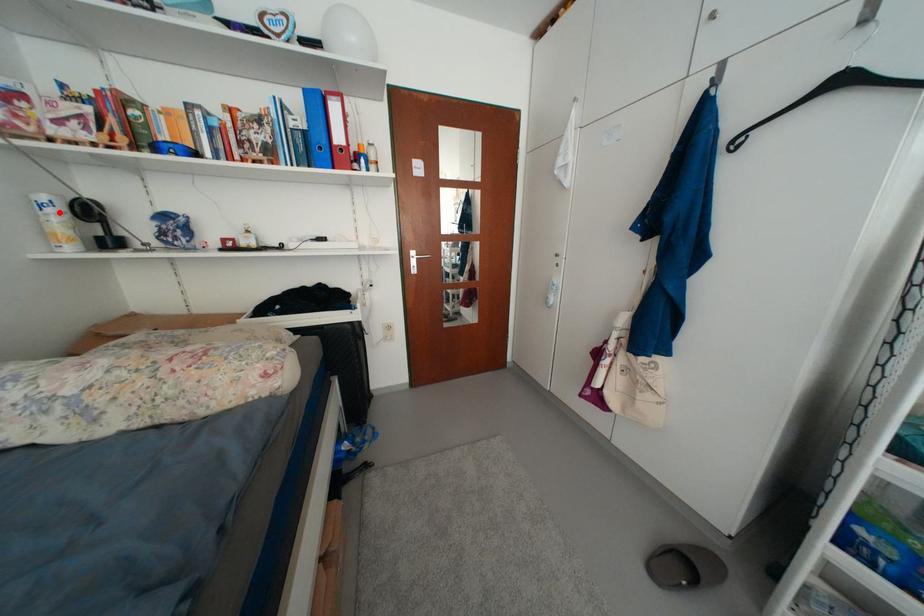
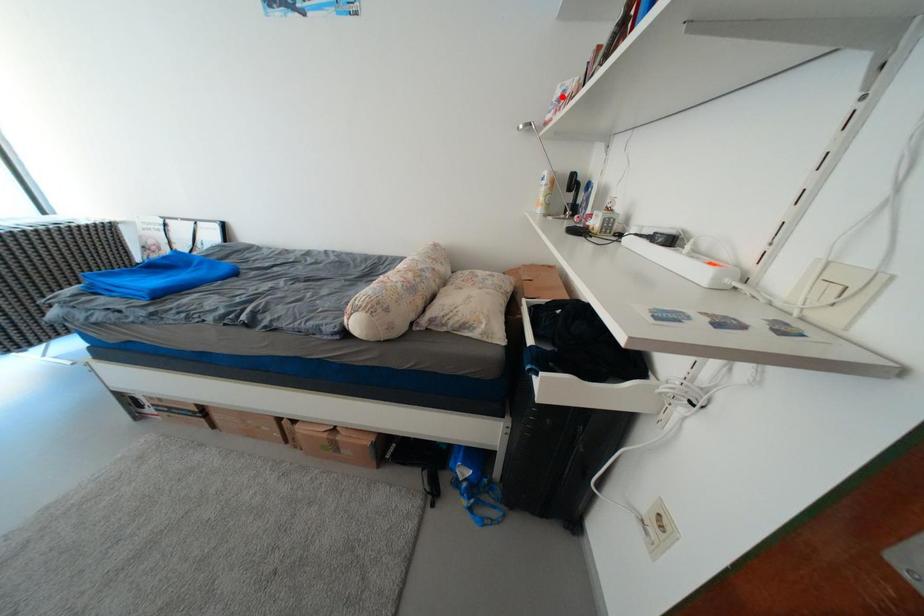
I am providing you with two images of the same scene from different viewpoints. A red point is marked on the first image and another point is marked on the second image. Is the marked point in image1 the same physical position as the marked point in image2?

No